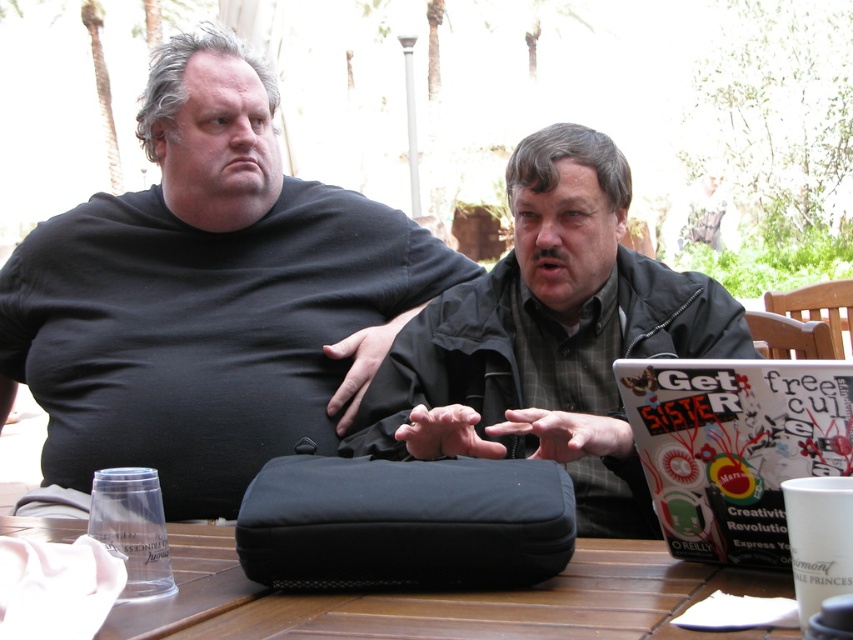
You are a photographer trying to capture a candid shot of the green plaid shirt at center without the black matte bag at center blocking the view. Can you adjust your position to do so?

The black matte bag at center is further to the viewer than the green plaid shirt at center, so moving your camera position slightly to the side or angle might allow you to see around the bag to capture the green plaid shirt at center without obstruction.

You are a delivery person standing at the edge of the table. You need to place a small package between the two points marked as point (729, 577) and point (416, 493). Which point should you place the package closer to so that it is in front of the other point?

You should place the small package closer to point (729, 577) because it is in front of point (416, 493). This ensures the package is positioned in front of the other point.

You are a delivery person who needs to place a small package on the table without disturbing the items already there. The black matte bag at center and the green plaid shirt at center are on the table. Which item should you move to make space?

The black matte bag at center is larger in size than the green plaid shirt at center, so moving the green plaid shirt at center would be easier to create space for the package.